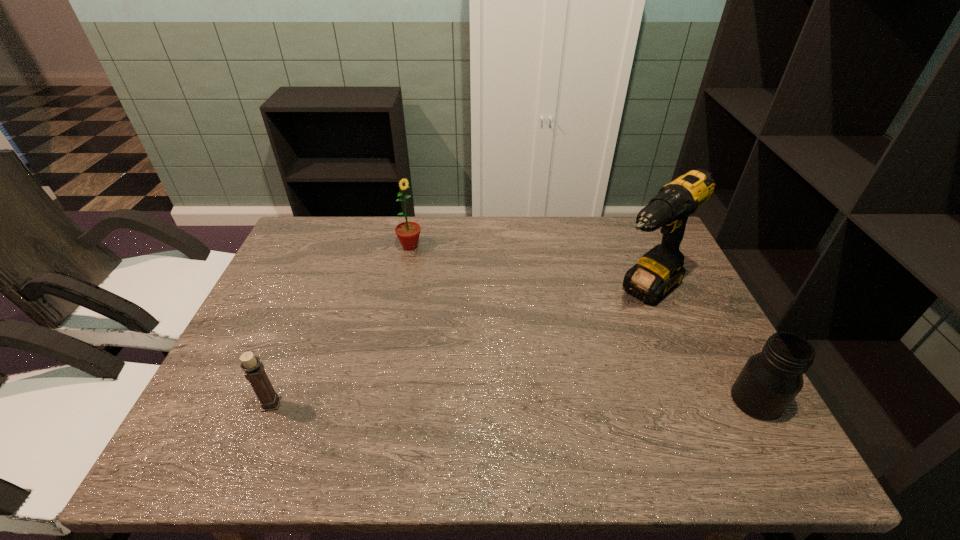
Image resolution: width=960 pixels, height=540 pixels. Identify the location of free area in between the farthest object and the candle holder. (341, 325).

Identify the location of vacant space in between the jar and the drill. This screenshot has height=540, width=960. (701, 346).

In order to click on vacant space that is in between the leftmost object and the jar in this screenshot , I will do `click(514, 402)`.

The height and width of the screenshot is (540, 960). What are the coordinates of `vacant area that lies between the third nearest object and the leftmost object` in the screenshot? It's located at (458, 348).

Where is `empty location between the jar and the second object from left to right`? Image resolution: width=960 pixels, height=540 pixels. empty location between the jar and the second object from left to right is located at coordinates (583, 323).

Where is `unoccupied position between the drill and the jar`? Image resolution: width=960 pixels, height=540 pixels. unoccupied position between the drill and the jar is located at coordinates (701, 346).

Find the location of `unoccupied area between the farthest object and the jar`. unoccupied area between the farthest object and the jar is located at coordinates (583, 323).

The height and width of the screenshot is (540, 960). What are the coordinates of `free point between the tallest object and the candle holder` in the screenshot? It's located at (458, 348).

The image size is (960, 540). In order to click on object that can be found as the closest to the leftmost object in this screenshot , I will do `click(408, 233)`.

Choose which object is the second nearest neighbor to the candle holder. Please provide its 2D coordinates. Your answer should be formatted as a tuple, i.e. [(x, y)], where the tuple contains the x and y coordinates of a point satisfying the conditions above.

[(659, 271)]